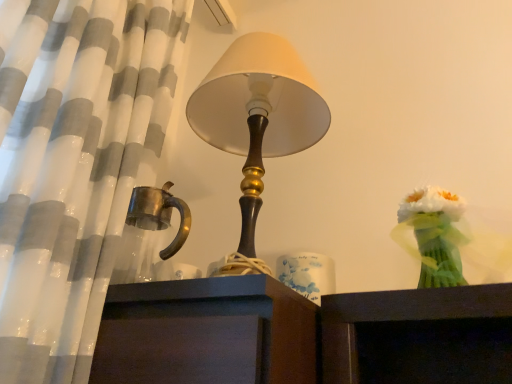
This screenshot has height=384, width=512. What do you see at coordinates (435, 235) in the screenshot?
I see `white silk bouquet at right` at bounding box center [435, 235].

Identify the location of white silk bouquet at right. (435, 235).

What do you see at coordinates (307, 274) in the screenshot? Image resolution: width=512 pixels, height=384 pixels. I see `white ceramic candle holder at center` at bounding box center [307, 274].

I want to click on white ceramic candle holder at center, so click(x=307, y=274).

Find the location of a particular element. The image size is (512, 384). white silk bouquet at right is located at coordinates pyautogui.click(x=435, y=235).

Which is more to the right, white silk bouquet at right or white ceramic candle holder at center?

Positioned to the right is white silk bouquet at right.

Between white silk bouquet at right and white ceramic candle holder at center, which one is positioned in front?

white silk bouquet at right is in front.

Which is more distant, (448, 196) or (302, 290)?

Positioned behind is point (302, 290).

From the image's perspective, is white silk bouquet at right located above or below white ceramic candle holder at center?

From the image's perspective, white silk bouquet at right appears above white ceramic candle holder at center.

From a real-world perspective, which object rests below the other?

white ceramic candle holder at center, from a real-world perspective.

Between white silk bouquet at right and white ceramic candle holder at center, which one has smaller width?

With smaller width is white ceramic candle holder at center.

Can you confirm if white silk bouquet at right is shorter than white ceramic candle holder at center?

In fact, white silk bouquet at right may be taller than white ceramic candle holder at center.

In terms of size, does white silk bouquet at right appear bigger or smaller than white ceramic candle holder at center?

white silk bouquet at right is bigger than white ceramic candle holder at center.

Do you think white silk bouquet at right is within white ceramic candle holder at center, or outside of it?

Answer: white silk bouquet at right is spatially situated outside white ceramic candle holder at center.

Is white silk bouquet at right not close to white ceramic candle holder at center?

Actually, white silk bouquet at right and white ceramic candle holder at center are a little close together.

Is white silk bouquet at right oriented towards white ceramic candle holder at center?

No, white silk bouquet at right is not oriented towards white ceramic candle holder at center.

How much distance is there between white silk bouquet at right and white ceramic candle holder at center?

white silk bouquet at right is 9.69 inches from white ceramic candle holder at center.

The height and width of the screenshot is (384, 512). In order to click on floral arrangement above the white ceramic candle holder at center (from the image's perspective) in this screenshot , I will do `click(435, 235)`.

In the scene shown: Would you say white ceramic candle holder at center is to the left or to the right of white silk bouquet at right in the picture?

From the image, it's evident that white ceramic candle holder at center is to the left of white silk bouquet at right.

In the image, is white ceramic candle holder at center positioned in front of or behind white silk bouquet at right?

Clearly, white ceramic candle holder at center is behind white silk bouquet at right.

Considering the positions of points (293, 276) and (414, 217), is point (293, 276) farther from camera compared to point (414, 217)?

Yes, point (293, 276) is behind point (414, 217).

From the image's perspective, relative to white silk bouquet at right, is white ceramic candle holder at center above or below?

white ceramic candle holder at center is situated lower than white silk bouquet at right in the image.

From a real-world perspective, is white ceramic candle holder at center positioned above or below white silk bouquet at right?

Clearly, from a real-world perspective, white ceramic candle holder at center is below white silk bouquet at right.

Can you confirm if white ceramic candle holder at center is thinner than white silk bouquet at right?

Yes.

From the picture: Is white ceramic candle holder at center taller or shorter than white silk bouquet at right?

In the image, white ceramic candle holder at center appears to be shorter than white silk bouquet at right.

Considering the sizes of objects white ceramic candle holder at center and white silk bouquet at right in the image provided, who is bigger, white ceramic candle holder at center or white silk bouquet at right?

white silk bouquet at right is bigger.

Is white silk bouquet at right located within white ceramic candle holder at center?

That's incorrect, white silk bouquet at right is not inside white ceramic candle holder at center.

Are white ceramic candle holder at center and white silk bouquet at right far apart?

No.

Does white ceramic candle holder at center turn towards white silk bouquet at right?

No.

What's the angular difference between white ceramic candle holder at center and white silk bouquet at right's facing directions?

The angular difference between white ceramic candle holder at center and white silk bouquet at right is 4.2 degrees.

Where is `floral arrangement to the right of white ceramic candle holder at center`? The width and height of the screenshot is (512, 384). floral arrangement to the right of white ceramic candle holder at center is located at coordinates (435, 235).

Locate an element on the screen. candle holder behind the white silk bouquet at right is located at coordinates (307, 274).

This screenshot has height=384, width=512. What are the coordinates of `floral arrangement that appears above the white ceramic candle holder at center (from a real-world perspective)` in the screenshot? It's located at (435, 235).